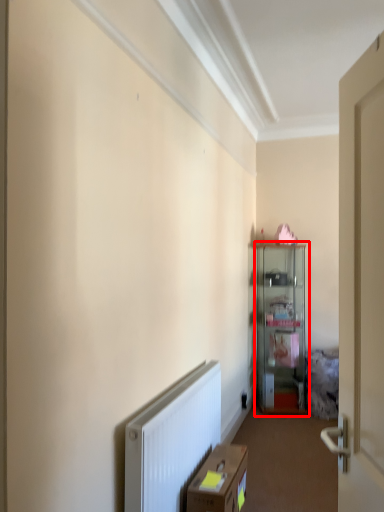
Question: Observing the image, what is the correct spatial positioning of cabinetry (annotated by the red box) in reference to cardboard box?

Choices:
 (A) left
 (B) right

Answer: (B)